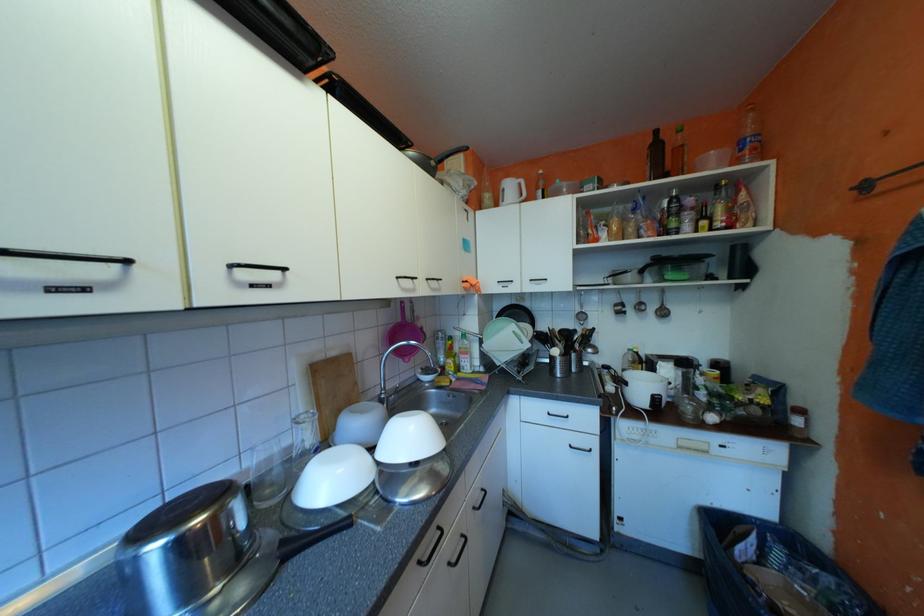
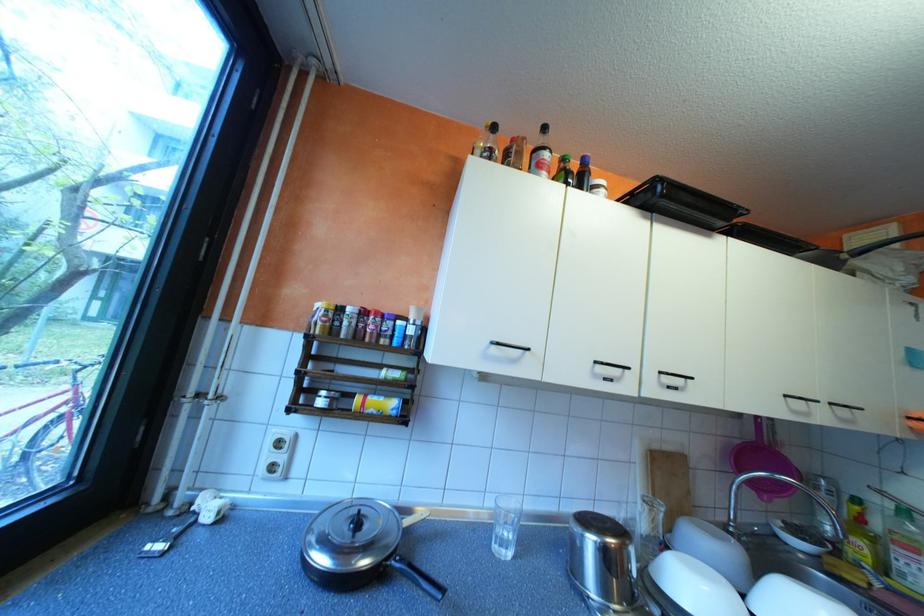
In the second image, find the point that corresponds to [341,74] in the first image.

(745, 224)